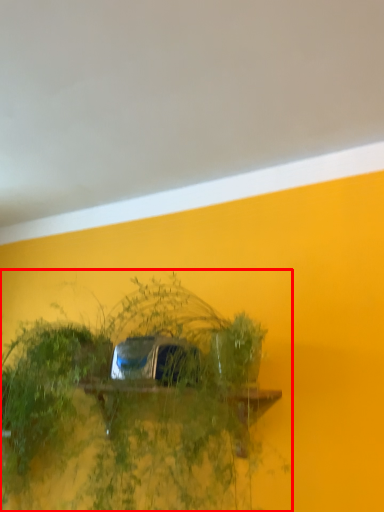
Question: From the image's perspective, what is the correct spatial relationship of houseplant (annotated by the red box) in relation to backdrop?

Choices:
 (A) above
 (B) below

Answer: (B)